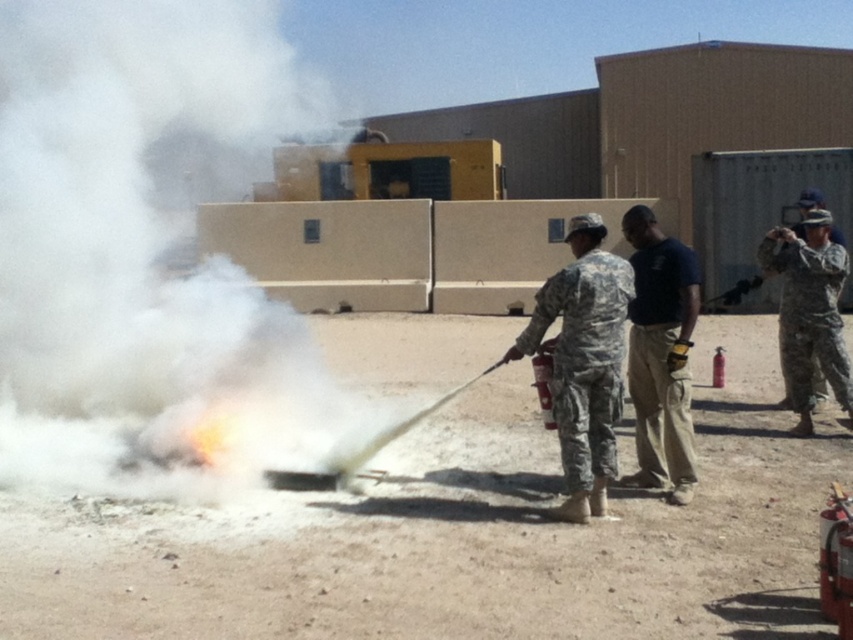
Question: Observing the image, what is the correct spatial positioning of camouflage uniform at center in reference to camouflage uniform at right?

Choices:
 (A) left
 (B) right

Answer: (A)

Question: Among these objects, which one is farthest from the camera?

Choices:
 (A) camouflage uniform at right
 (B) dark blue t-shirt at center
 (C) camouflage uniform at center

Answer: (A)

Question: Is camouflage uniform at center to the right of dark blue t-shirt at center from the viewer's perspective?

Choices:
 (A) no
 (B) yes

Answer: (A)

Question: Can you confirm if dark blue t-shirt at center is positioned to the left of camouflage uniform at right?

Choices:
 (A) yes
 (B) no

Answer: (A)

Question: Which object appears closest to the camera in this image?

Choices:
 (A) dark blue t-shirt at center
 (B) camouflage uniform at center
 (C) camouflage uniform at right

Answer: (B)

Question: Which point is closer to the camera taking this photo?

Choices:
 (A) (780, 237)
 (B) (665, 384)
 (C) (601, 224)

Answer: (C)